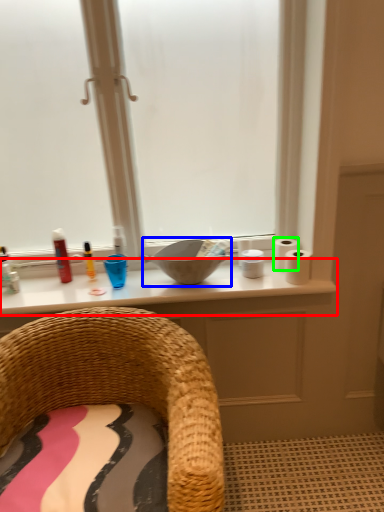
Question: Estimate the real-world distances between objects in this image. Which object is closer to counter top (highlighted by a red box), sink (highlighted by a blue box) or toilet paper (highlighted by a green box)?

Choices:
 (A) sink
 (B) toilet paper

Answer: (A)